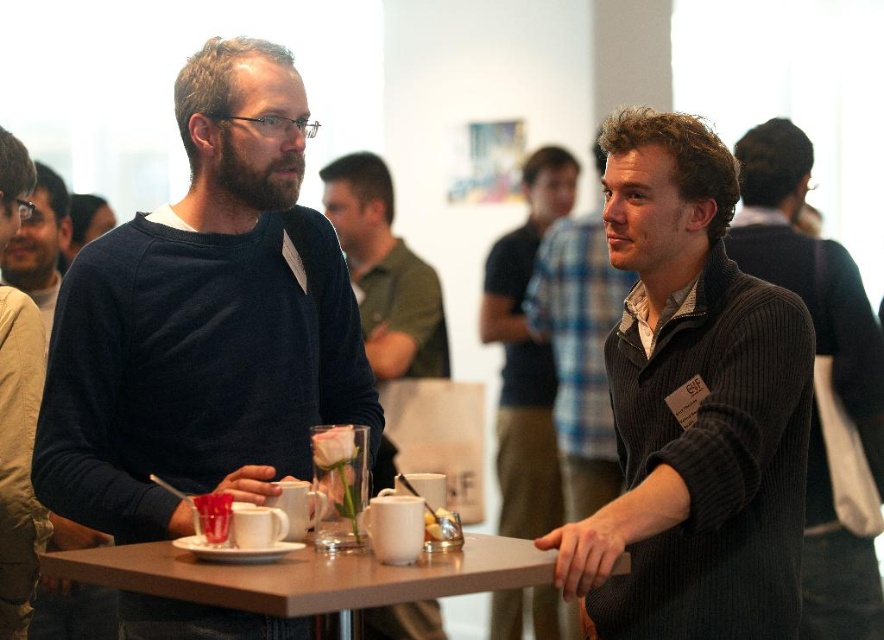
Is point (494, 337) farther from camera compared to point (570, 230)?

That is True.

Does blue plaid shirt at center appear over knitted dark gray sweater at center?

Incorrect, blue plaid shirt at center is not positioned above knitted dark gray sweater at center.

Is point (536, 412) closer to viewer compared to point (580, 333)?

That is False.

Identify the location of blue plaid shirt at center. (526, 353).

Which is behind, point (14, 208) or point (24, 225)?

The point (24, 225) is behind.

Identify the location of beige cotton shirt at left. (18, 458).

Where is `beige cotton shirt at left`? Image resolution: width=884 pixels, height=640 pixels. beige cotton shirt at left is located at coordinates (18, 458).

Who is lower down, ribbed sweater at center or matte brown table at center?

matte brown table at center is lower down.

Between ribbed sweater at center and matte brown table at center, which one has less height?

Standing shorter between the two is matte brown table at center.

Is point (798, 276) closer to viewer compared to point (309, 568)?

No, it is behind (309, 568).

This screenshot has width=884, height=640. What are the coordinates of `ribbed sweater at center` in the screenshot? It's located at (820, 380).